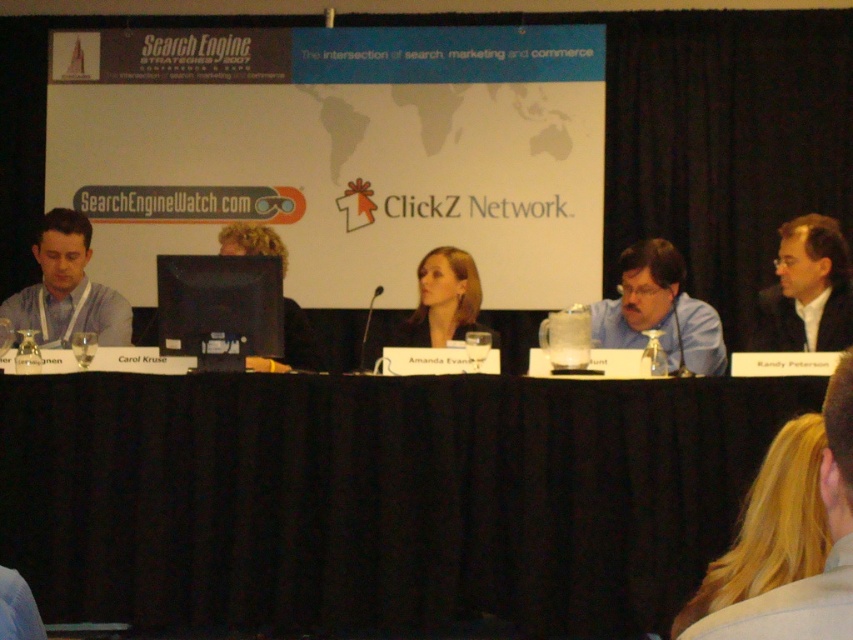
You are standing in front of the conference table at the Search Engine Strategies 2007 event. There is a point marked at coordinates (321,570) on the table. If you want to place a 1.5 meter long banner on the table without overlapping any existing items, can you fit it along the length of the table from that point?

The point at (321,570) is 4.10 meters away from the viewer. Since the banner is 1.5 meters long, there is sufficient space along the table from that point to accommodate it without overlapping existing items.

You are organizing a panel discussion and need to seat two speakers based on their clothing and appearance. The speakers are wearing a matte gray shirt at left and have blonde hair man at center. According to the seating arrangement in the image, which speaker should be seated closer to the audience to ensure visibility?

The matte gray shirt at left has a smaller size compared to the blonde hair man at center, so the speaker wearing the matte gray shirt at left should be seated closer to the audience to compensate for their smaller stature and ensure visibility.